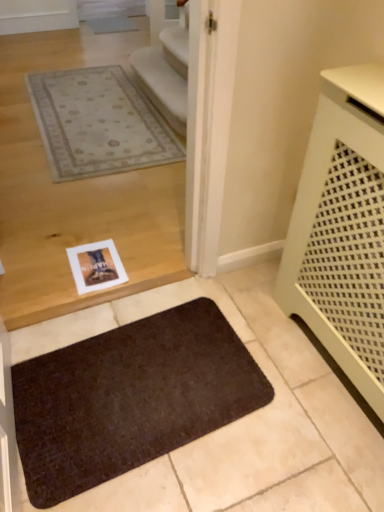
This screenshot has width=384, height=512. Identify the location of free spot below white perforated radiator at right (from a real-world perspective). (322, 359).